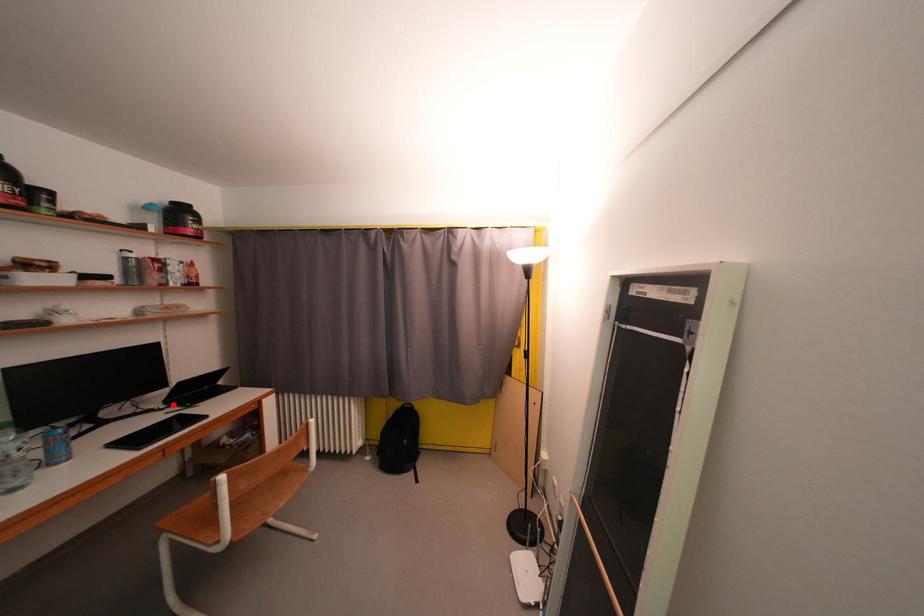
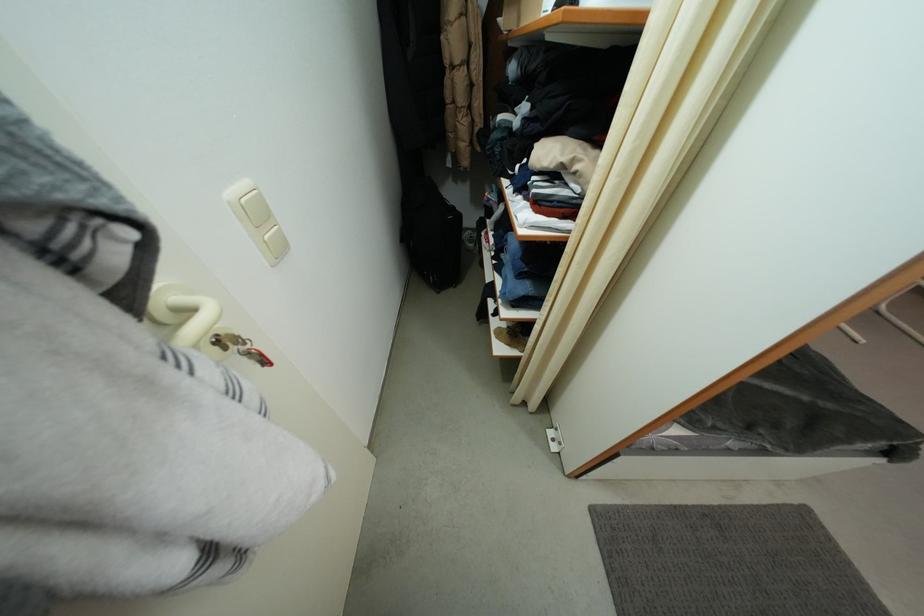
Question: I am providing you with two images of the same scene from different viewpoints. A red point is marked on the first image. Is the red point's position out of view in image 2?

Choices:
 (A) Yes
 (B) No

Answer: (A)